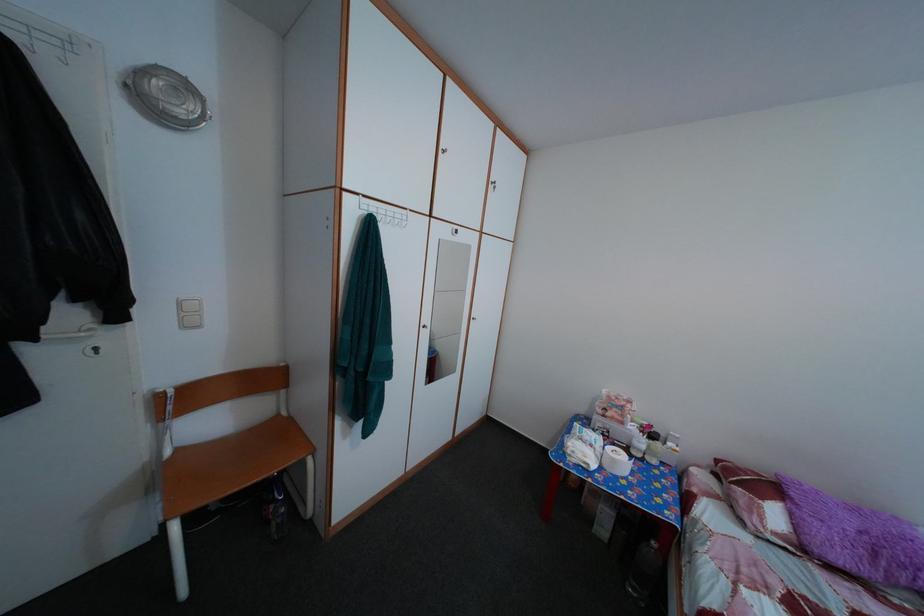
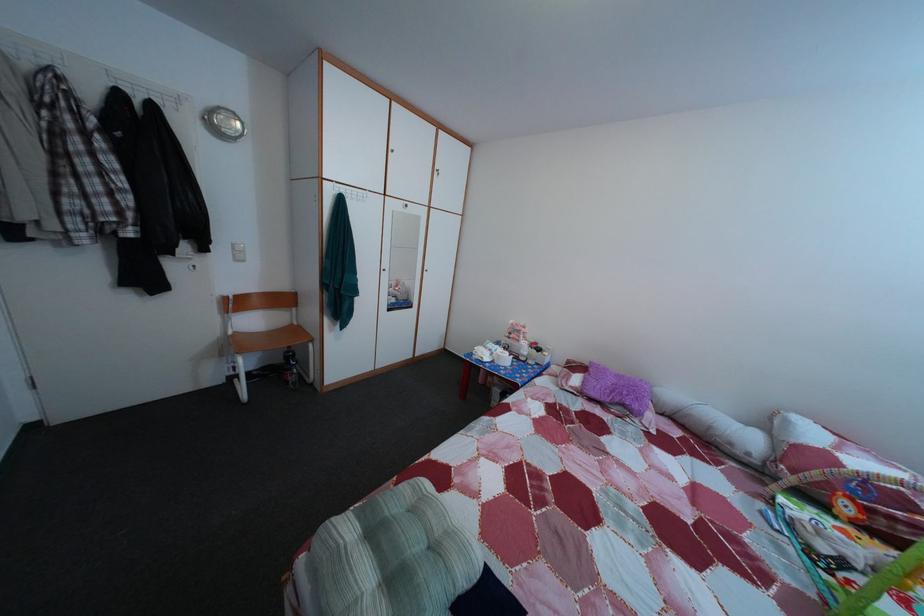
Find the pixel in the second image that matches (188,310) in the first image.

(242, 254)